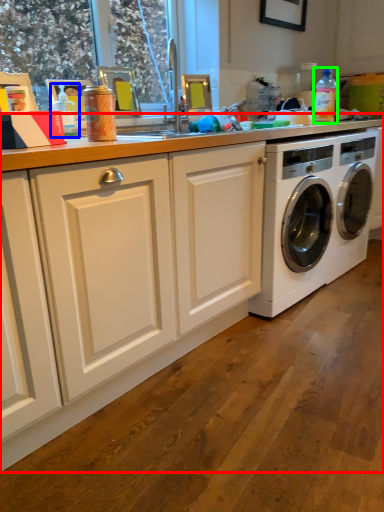
Question: Based on their relative distances, which object is farther from countertop (highlighted by a red box)? Choose from bottle (highlighted by a blue box) and bottle (highlighted by a green box).

Choices:
 (A) bottle
 (B) bottle

Answer: (B)